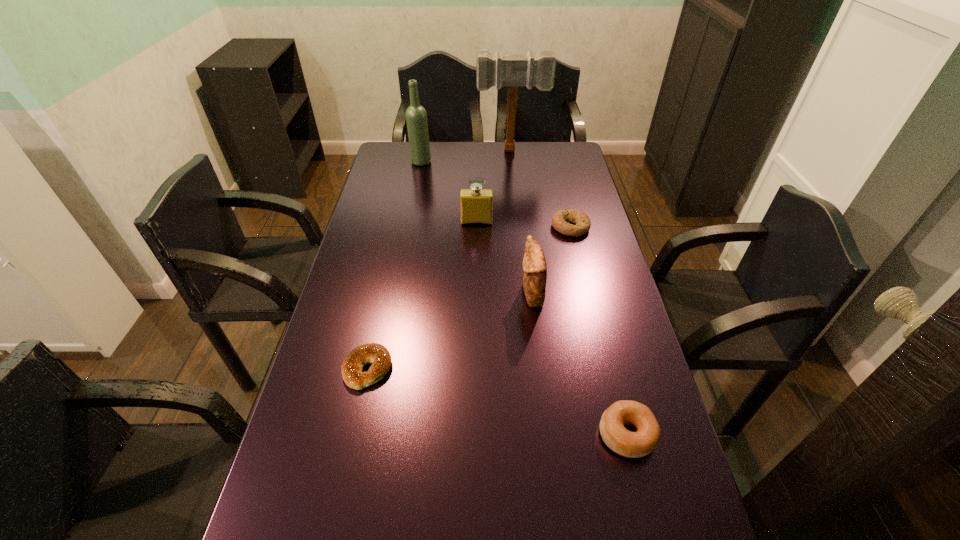
The image size is (960, 540). Find the location of `the second farthest bagel`. the second farthest bagel is located at coordinates (352, 367).

The image size is (960, 540). Find the location of `blank area located on the front of the farthest object`. blank area located on the front of the farthest object is located at coordinates (517, 208).

This screenshot has width=960, height=540. Find the location of `vacant region located on the right of the second farthest object`. vacant region located on the right of the second farthest object is located at coordinates (503, 161).

Where is `blank space located 0.250m on the front-facing side of the perfume`? The image size is (960, 540). blank space located 0.250m on the front-facing side of the perfume is located at coordinates (476, 276).

Find the location of `vacant point located on the open side of the fifth farthest object`. vacant point located on the open side of the fifth farthest object is located at coordinates coord(420,295).

The height and width of the screenshot is (540, 960). What are the coordinates of `vacant area situated on the open side of the fifth farthest object` in the screenshot? It's located at (447, 295).

Where is `free location located on the open side of the fifth farthest object`? This screenshot has width=960, height=540. free location located on the open side of the fifth farthest object is located at coordinates click(465, 295).

This screenshot has height=540, width=960. Find the location of `free point located on the back of the nearest bagel`. free point located on the back of the nearest bagel is located at coordinates (602, 338).

This screenshot has width=960, height=540. Find the location of `vacant region located 0.120m on the left of the farthest bagel`. vacant region located 0.120m on the left of the farthest bagel is located at coordinates (516, 227).

At what (x,y) coordinates should I click in order to perform the action: click on vacant space situated 0.250m on the back of the second nearest bagel. Please return your answer as a coordinate pair (x, y). Looking at the image, I should click on (387, 281).